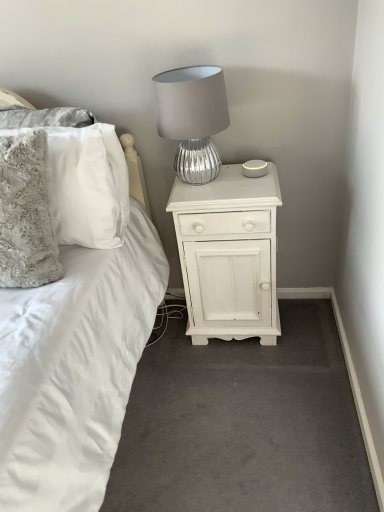
Question: Does fluffy gray pillow at left, marked as the 1th pillow in a front-to-back arrangement, have a greater width compared to fluffy white pillow at left, the first pillow viewed from the back?

Choices:
 (A) no
 (B) yes

Answer: (B)

Question: Does fluffy gray pillow at left, the 2th pillow in the back-to-front sequence, have a smaller size compared to fluffy white pillow at left, the first pillow viewed from the back?

Choices:
 (A) yes
 (B) no

Answer: (B)

Question: From the image's perspective, would you say fluffy gray pillow at left, the 2th pillow in the back-to-front sequence, is shown under fluffy white pillow at left, which is the second pillow from front to back?

Choices:
 (A) no
 (B) yes

Answer: (B)

Question: Is fluffy gray pillow at left, marked as the 1th pillow in a front-to-back arrangement, facing away from fluffy white pillow at left, the first pillow viewed from the back?

Choices:
 (A) yes
 (B) no

Answer: (A)

Question: Considering the relative positions of fluffy gray pillow at left, marked as the 1th pillow in a front-to-back arrangement, and fluffy white pillow at left, the first pillow viewed from the back, in the image provided, is fluffy gray pillow at left, marked as the 1th pillow in a front-to-back arrangement, to the right of fluffy white pillow at left, the first pillow viewed from the back, from the viewer's perspective?

Choices:
 (A) no
 (B) yes

Answer: (A)

Question: Is fluffy gray pillow at left, the 2th pillow in the back-to-front sequence, outside fluffy white pillow at left, which is the second pillow from front to back?

Choices:
 (A) yes
 (B) no

Answer: (A)

Question: Are white painted wood nightstand at center and silver textured lamp at upper center located far from each other?

Choices:
 (A) yes
 (B) no

Answer: (B)

Question: Can you confirm if white painted wood nightstand at center is positioned to the right of silver textured lamp at upper center?

Choices:
 (A) no
 (B) yes

Answer: (B)

Question: Does white painted wood nightstand at center have a lesser width compared to silver textured lamp at upper center?

Choices:
 (A) no
 (B) yes

Answer: (A)

Question: From a real-world perspective, is white painted wood nightstand at center below silver textured lamp at upper center?

Choices:
 (A) yes
 (B) no

Answer: (A)

Question: Is white painted wood nightstand at center aimed at silver textured lamp at upper center?

Choices:
 (A) no
 (B) yes

Answer: (A)

Question: Is white painted wood nightstand at center further to the viewer compared to silver textured lamp at upper center?

Choices:
 (A) yes
 (B) no

Answer: (A)

Question: Can you confirm if white painted wood nightstand at center is positioned to the right of fluffy gray pillow at left, marked as the 1th pillow in a front-to-back arrangement?

Choices:
 (A) yes
 (B) no

Answer: (A)